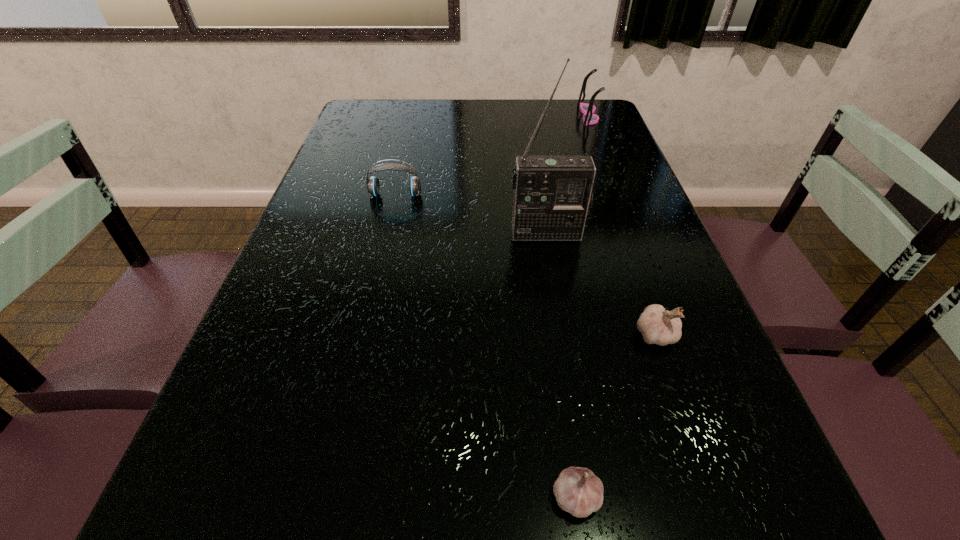
In the image, there is a desktop. At what (x,y) coordinates should I click in order to perform the action: click on free region at the far edge. Please return your answer as a coordinate pair (x, y). Image resolution: width=960 pixels, height=540 pixels. Looking at the image, I should click on (443, 131).

In the image, there is a desktop. Where is `vacant space at the near edge`? The image size is (960, 540). vacant space at the near edge is located at coordinates (451, 539).

Where is `free spot at the left edge of the desktop`? free spot at the left edge of the desktop is located at coordinates (202, 453).

Image resolution: width=960 pixels, height=540 pixels. I want to click on free space at the right edge of the desktop, so click(x=696, y=350).

This screenshot has width=960, height=540. Find the location of `vacant area at the far left corner of the desktop`. vacant area at the far left corner of the desktop is located at coordinates (372, 101).

In the image, there is a desktop. Find the location of `vacant space at the far right corner`. vacant space at the far right corner is located at coordinates (564, 111).

Where is `free space between the tallest object and the leftmost object`? This screenshot has height=540, width=960. free space between the tallest object and the leftmost object is located at coordinates (471, 214).

Identify the location of free spot between the left garlic and the third farthest object. (562, 366).

I want to click on free space between the second tallest object and the nearer garlic, so click(x=583, y=307).

At what (x,y) coordinates should I click in order to perform the action: click on empty location between the taller garlic and the shorter garlic. Please return your answer as a coordinate pair (x, y). The height and width of the screenshot is (540, 960). Looking at the image, I should click on tap(616, 416).